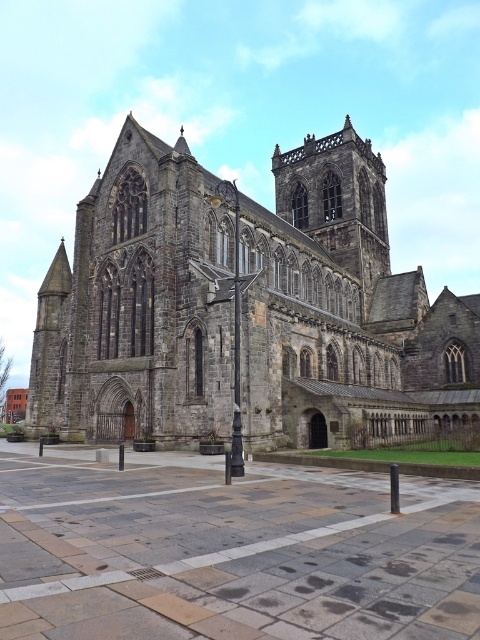
Between dark gray stone church at center and smooth black pole at center, which one is positioned higher?

dark gray stone church at center is above.

Does dark gray stone church at center have a larger size compared to smooth black pole at center?

Indeed, dark gray stone church at center has a larger size compared to smooth black pole at center.

Where is `dark gray stone church at center`? dark gray stone church at center is located at coordinates (343, 310).

The width and height of the screenshot is (480, 640). Identify the location of dark gray stone church at center. (343, 310).